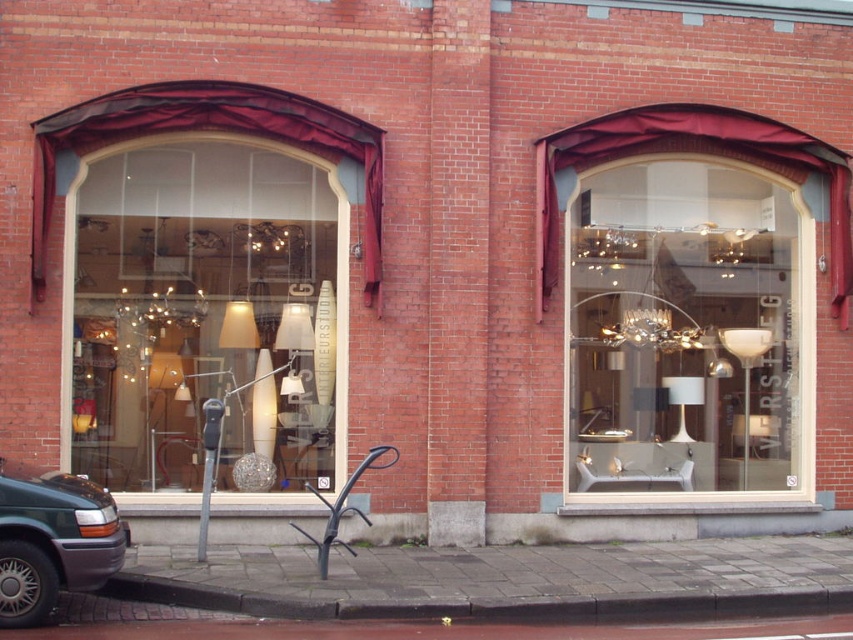
Consider the image. Is brick at lower left wider than metallic gray van at lower left?

Yes.

Can you confirm if brick at lower left is positioned above metallic gray van at lower left?

Incorrect, brick at lower left is not positioned above metallic gray van at lower left.

Measure the distance between brick at lower left and camera.

brick at lower left is 29.09 feet away from camera.

I want to click on brick at lower left, so click(x=489, y=604).

Is point (637, 120) less distant than point (30, 566)?

No, it is not.

Is velvet burgundy curtain at upper center positioned before metallic gray van at lower left?

No, it is behind metallic gray van at lower left.

Which is in front, point (744, 136) or point (100, 536)?

Point (100, 536) is more forward.

Locate an element on the screen. The height and width of the screenshot is (640, 853). velvet burgundy curtain at upper center is located at coordinates (695, 150).

Which is more to the right, matte glass lamp at center or velvet burgundy curtain at upper center?

Positioned to the right is velvet burgundy curtain at upper center.

Which is below, matte glass lamp at center or velvet burgundy curtain at upper center?

Positioned lower is matte glass lamp at center.

Between point (140, 221) and point (784, 157), which one is positioned in front?

Point (140, 221)

Where is `matte glass lamp at center`? The height and width of the screenshot is (640, 853). matte glass lamp at center is located at coordinates point(206,314).